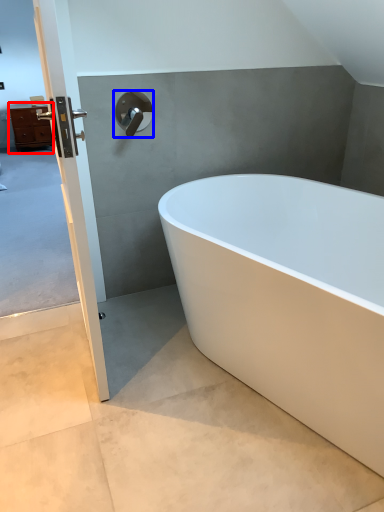
Question: Which object is further to the camera taking this photo, chest of drawers (highlighted by a red box) or tap (highlighted by a blue box)?

Choices:
 (A) chest of drawers
 (B) tap

Answer: (A)